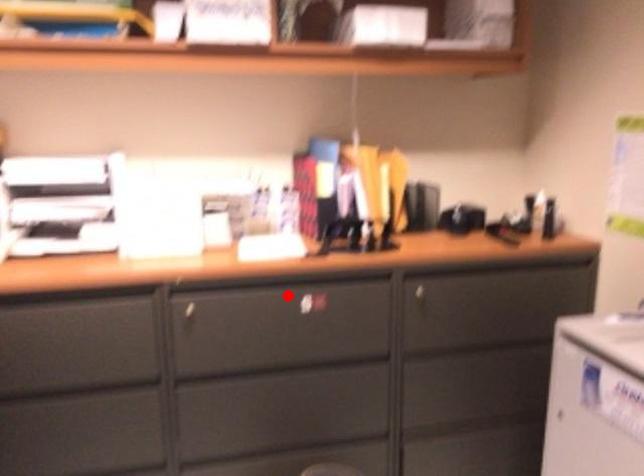
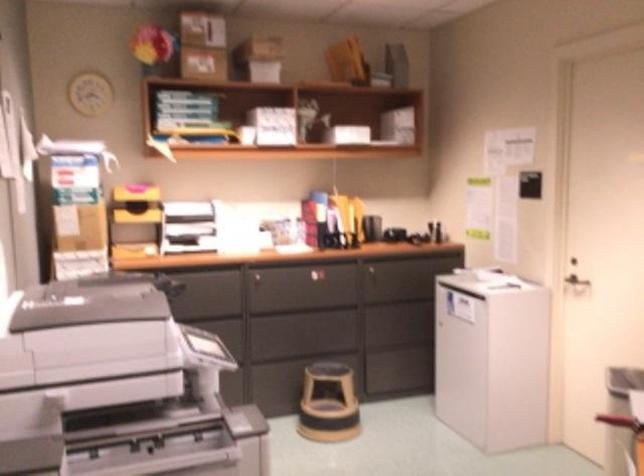
The point at the highlighted location is marked in the first image. Where is the corresponding point in the second image?

(306, 272)